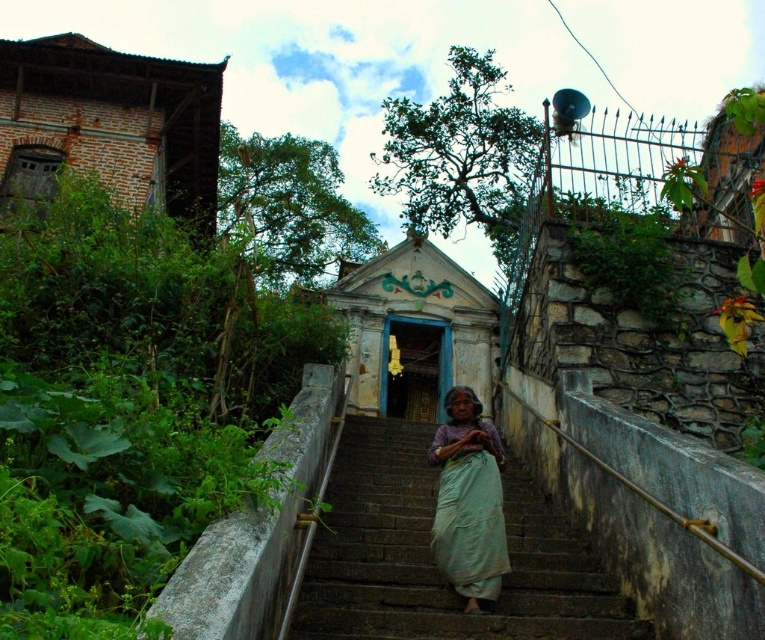
You are a tourist standing at the entrance of the building with coordinates 0.0, 0.0. You want to reach the top of the brown stone stairs at center. According to the map, the stairs are located at point 0.873, 0.566. In which direction should you move to reach them?

The brown stone stairs at center are located at point (431, 557), so you should move towards the northeast direction from your current position at (0, 0) to reach them.